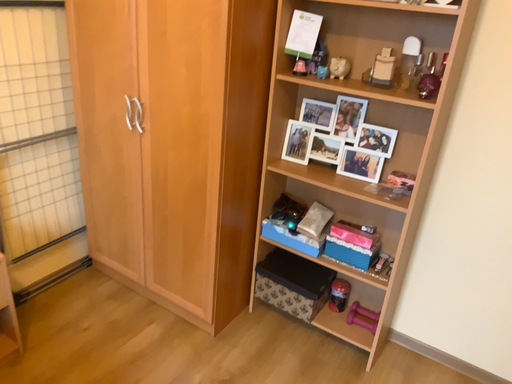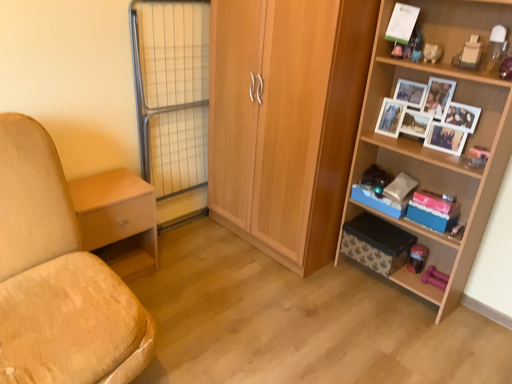
Question: How did the camera likely rotate when shooting the video?

Choices:
 (A) rotated right
 (B) rotated left

Answer: (B)